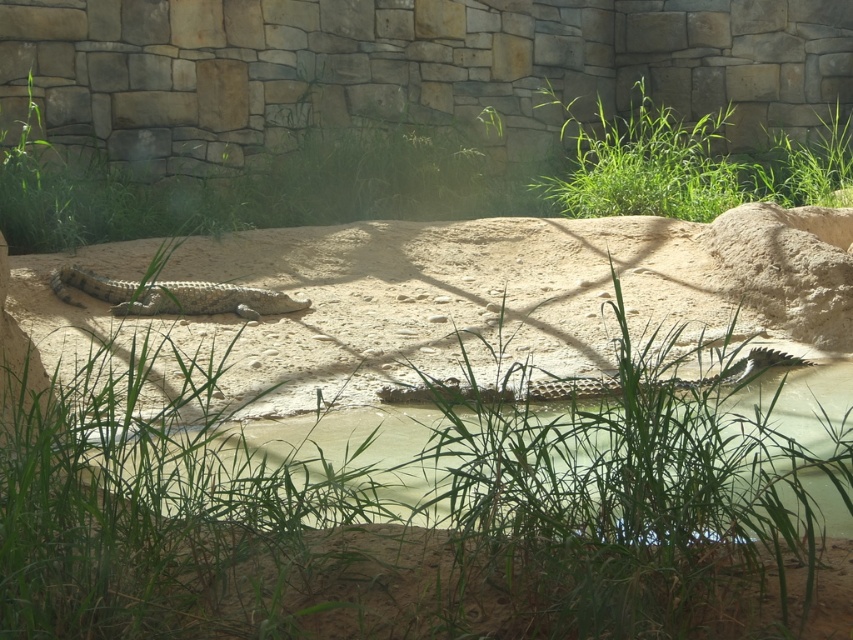
Question: Is leathery brown crocodile at center thinner than leathery greenish-brown crocodile at center?

Choices:
 (A) no
 (B) yes

Answer: (A)

Question: Can you confirm if leathery brown crocodile at center is positioned above leathery greenish-brown crocodile at center?

Choices:
 (A) no
 (B) yes

Answer: (B)

Question: Which of the following is the farthest from the observer?

Choices:
 (A) (189, 314)
 (B) (572, 394)

Answer: (A)

Question: Which object is farther from the camera taking this photo?

Choices:
 (A) leathery brown crocodile at center
 (B) leathery greenish-brown crocodile at center

Answer: (A)

Question: Does leathery brown crocodile at center appear on the left side of leathery greenish-brown crocodile at center?

Choices:
 (A) no
 (B) yes

Answer: (B)

Question: Which object is closer to the camera taking this photo?

Choices:
 (A) leathery greenish-brown crocodile at center
 (B) leathery brown crocodile at center

Answer: (A)